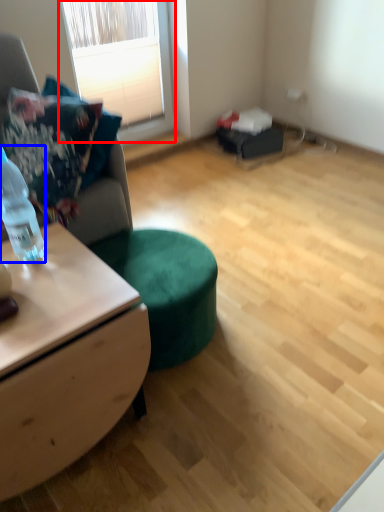
Question: Which object appears closest to the camera in this image, window (highlighted by a red box) or bottle (highlighted by a blue box)?

Choices:
 (A) window
 (B) bottle

Answer: (B)